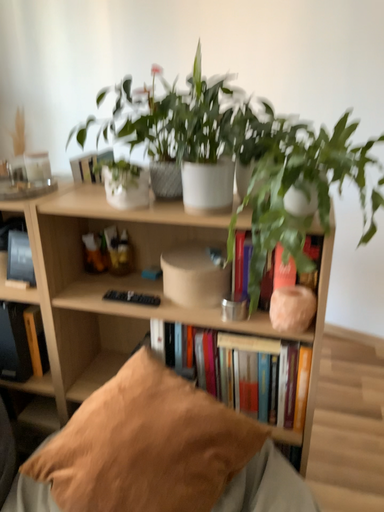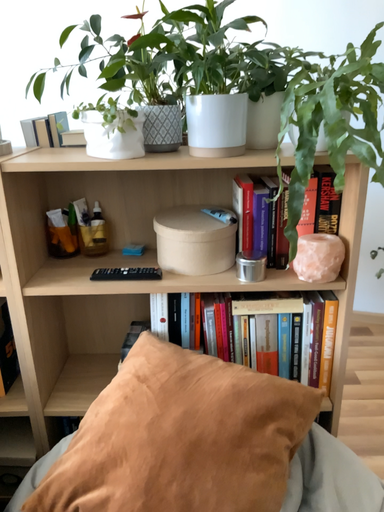
Question: Which way did the camera rotate in the video?

Choices:
 (A) rotated right
 (B) rotated left

Answer: (A)